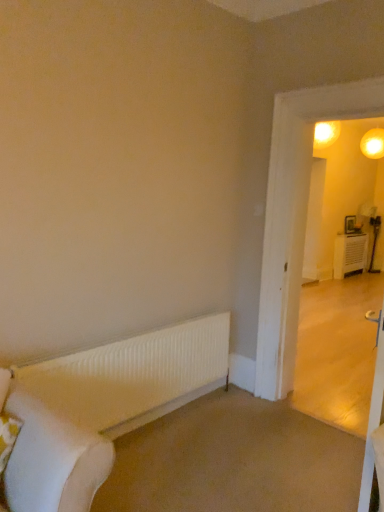
Question: Should I look upward or downward to see white ribbed radiator at lower left?

Choices:
 (A) up
 (B) down

Answer: (B)